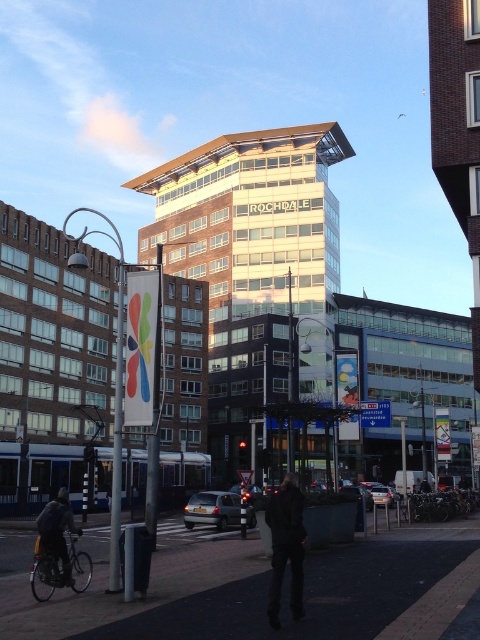
Does dark fabric jacket at center lie behind dark blue jacket at lower left?

No, it is in front of dark blue jacket at lower left.

Who is positioned more to the right, dark fabric jacket at center or dark blue jacket at lower left?

Positioned to the right is dark fabric jacket at center.

You are a GUI agent. You are given a task and a screenshot of the screen. Output one action in this format:
    pyautogui.click(x=<x>, y=<y>)
    Task: Click on the dark fabric jacket at center
    The height and width of the screenshot is (640, 480).
    Given the screenshot: What is the action you would take?
    pyautogui.click(x=286, y=547)

Who is higher up, dark fabric jacket at center or white plastic banner at center?

white plastic banner at center is above.

Can you confirm if dark fabric jacket at center is bigger than white plastic banner at center?

No, dark fabric jacket at center is not bigger than white plastic banner at center.

At what (x,y) coordinates should I click in order to perform the action: click on dark fabric jacket at center. Please return your answer as a coordinate pair (x, y). This screenshot has width=480, height=640. Looking at the image, I should click on (286, 547).

Is white plastic banner at center shorter than dark blue jacket at lower left?

Incorrect, white plastic banner at center's height does not fall short of dark blue jacket at lower left's.

What do you see at coordinates (117, 442) in the screenshot? The height and width of the screenshot is (640, 480). I see `white plastic banner at center` at bounding box center [117, 442].

You are a GUI agent. You are given a task and a screenshot of the screen. Output one action in this format:
    pyautogui.click(x=<x>, y=<y>)
    Task: Click on the white plastic banner at center
    This screenshot has height=640, width=480.
    Given the screenshot: What is the action you would take?
    pyautogui.click(x=117, y=442)